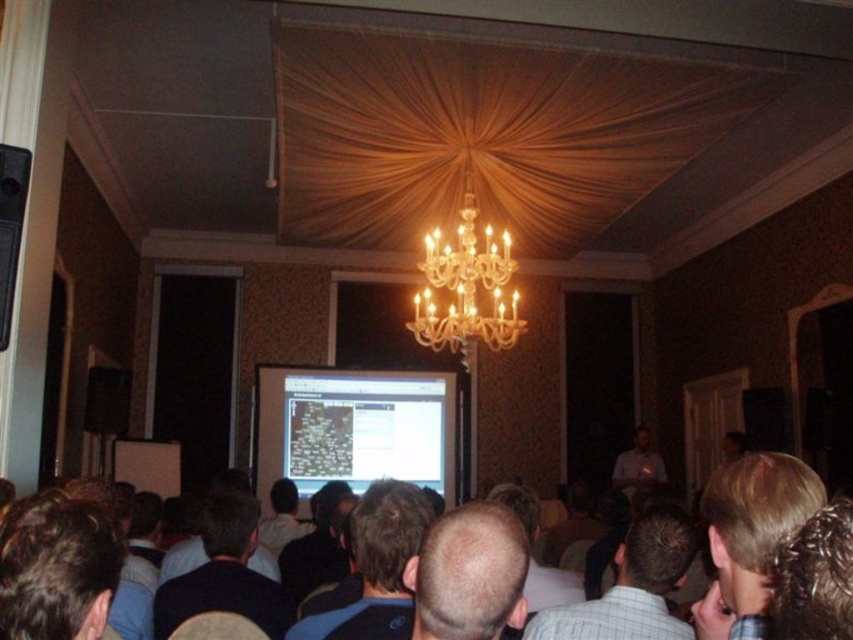
Question: Estimate the real-world distances between objects in this image. Which object is farther from the dark blue shirt at lower left?

Choices:
 (A) dark blue shirt at center
 (B) blonde hair at upper right

Answer: (B)

Question: Which point is closer to the camera taking this photo?

Choices:
 (A) (86, 612)
 (B) (451, 337)

Answer: (A)

Question: Which object is the closest to the dark blue fabric at center?

Choices:
 (A) bald head at center
 (B) dark blue shirt at center

Answer: (A)

Question: Does dark blue shirt at lower left appear under black plastic speaker at left?

Choices:
 (A) yes
 (B) no

Answer: (A)

Question: Can you confirm if bald head at center is positioned above light blue shirt at center?

Choices:
 (A) no
 (B) yes

Answer: (B)

Question: Can you confirm if blonde hair at upper right is positioned below dark blue shirt at center?

Choices:
 (A) yes
 (B) no

Answer: (B)